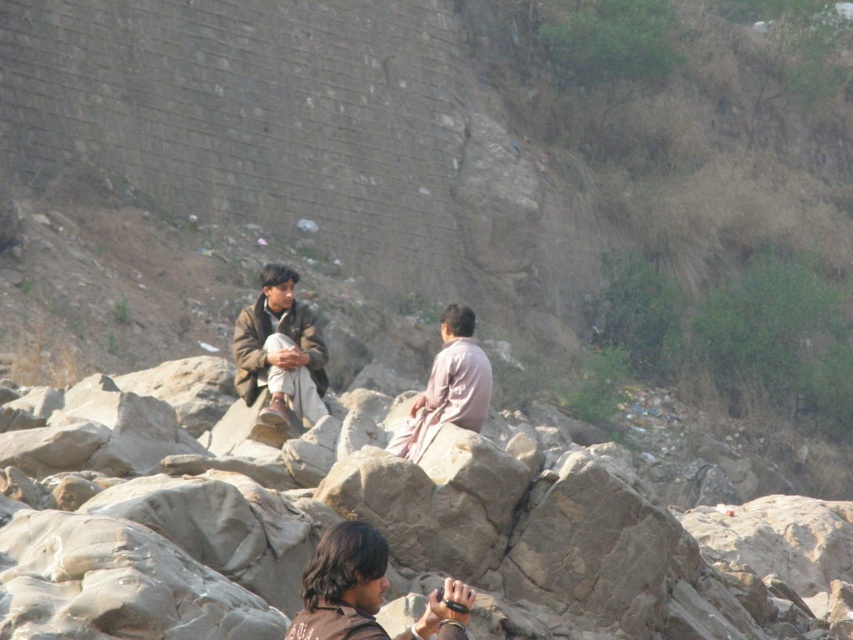
Consider the image. Is smooth rock at center positioned in front of brown leather jacket at lower center?

Yes, smooth rock at center is in front of brown leather jacket at lower center.

Can you confirm if smooth rock at center is wider than brown leather jacket at lower center?

Indeed, smooth rock at center has a greater width compared to brown leather jacket at lower center.

In order to click on smooth rock at center in this screenshot , I will do `click(383, 531)`.

At what (x,y) coordinates should I click in order to perform the action: click on smooth rock at center. Please return your answer as a coordinate pair (x, y). The height and width of the screenshot is (640, 853). Looking at the image, I should click on (383, 531).

Is brown leather jacket at center taller than pale pink fabric at center?

Indeed, brown leather jacket at center has a greater height compared to pale pink fabric at center.

Which is more to the left, brown leather jacket at center or pale pink fabric at center?

Result: Positioned to the left is brown leather jacket at center.

Which is in front, point (312, 323) or point (451, 365)?

Point (451, 365)

At what (x,y) coordinates should I click in order to perform the action: click on brown leather jacket at center. Please return your answer as a coordinate pair (x, y). Looking at the image, I should click on (280, 352).

Is point (321, 634) less distant than point (259, 388)?

Yes, point (321, 634) is closer to viewer.

Between brown leather jacket at lower center and brown leather jacket at center, which one has less height?

Standing shorter between the two is brown leather jacket at lower center.

Find the location of a particular element. brown leather jacket at lower center is located at coordinates (366, 593).